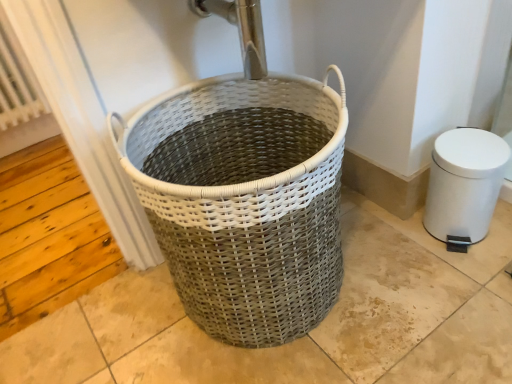
In order to face white plastic bidet at right, should I rotate leftwards or rightwards?

Turn right approximately 26.236 degrees to face it.

Identify the location of white textured radiator at left. Image resolution: width=512 pixels, height=384 pixels. (17, 82).

Image resolution: width=512 pixels, height=384 pixels. What do you see at coordinates (17, 82) in the screenshot? I see `white textured radiator at left` at bounding box center [17, 82].

I want to click on white plastic bidet at right, so click(464, 184).

Is white plastic bidet at right positioned far away from white textured radiator at left?

Yes, white plastic bidet at right and white textured radiator at left are quite far apart.

You are a GUI agent. You are given a task and a screenshot of the screen. Output one action in this format:
    pyautogui.click(x=<x>, y=<y>)
    Task: Click on the bidet located underneath the white textured radiator at left (from a real-world perspective)
    This screenshot has height=384, width=512.
    Given the screenshot: What is the action you would take?
    pyautogui.click(x=464, y=184)

Based on the photo, between white plastic bidet at right and white textured radiator at left, which one has smaller width?

white textured radiator at left.

Measure the distance from white plastic bidet at right to white textured radiator at left.

white plastic bidet at right is 1.58 meters away from white textured radiator at left.

Is the depth of white textured radiator at left greater than that of white woven basket at center?

Yes, it is behind white woven basket at center.

Considering the sizes of white textured radiator at left and white woven basket at center in the image, is white textured radiator at left wider or thinner than white woven basket at center?

white textured radiator at left is thinner than white woven basket at center.

Is white textured radiator at left oriented away from white woven basket at center?

No.

Where is `radiator on the left of white woven basket at center`? Image resolution: width=512 pixels, height=384 pixels. radiator on the left of white woven basket at center is located at coordinates (17, 82).

Which of these two, white plastic bidet at right or white woven basket at center, stands taller?

white woven basket at center.

Looking at this image, which of these two, white plastic bidet at right or white woven basket at center, is thinner?

Thinner between the two is white plastic bidet at right.

From a real-world perspective, is white plastic bidet at right below white woven basket at center?

Yes, from a real-world perspective, white plastic bidet at right is beneath white woven basket at center.

Which point is more distant from viewer, (443, 157) or (282, 108)?

Positioned behind is point (282, 108).

Are white textured radiator at left and white plastic bidet at right beside each other?

They are not placed beside each other.

Is point (7, 37) positioned before point (434, 208)?

No.

Between white textured radiator at left and white plastic bidet at right, which one has smaller size?

Smaller between the two is white plastic bidet at right.

Who is shorter, white textured radiator at left or white plastic bidet at right?

white plastic bidet at right is shorter.

Considering the relative sizes of white woven basket at center and white plastic bidet at right in the image provided, is white woven basket at center wider than white plastic bidet at right?

Correct, the width of white woven basket at center exceeds that of white plastic bidet at right.

From a real-world perspective, between white woven basket at center and white plastic bidet at right, who is vertically lower?

white plastic bidet at right, from a real-world perspective.

Does white woven basket at center appear on the left side of white plastic bidet at right?

Yes, white woven basket at center is to the left of white plastic bidet at right.

In the scene shown: From the image's perspective, is white woven basket at center below white textured radiator at left?

Correct, white woven basket at center appears lower than white textured radiator at left in the image.

Is white woven basket at center facing towards white textured radiator at left?

No, white woven basket at center is not facing towards white textured radiator at left.

Which object is thinner, white woven basket at center or white textured radiator at left?

With smaller width is white textured radiator at left.

This screenshot has height=384, width=512. In order to click on radiator above the white plastic bidet at right (from the image's perspective) in this screenshot , I will do `click(17, 82)`.

You are a GUI agent. You are given a task and a screenshot of the screen. Output one action in this format:
    pyautogui.click(x=<x>, y=<y>)
    Task: Click on the waste container in front of the white textured radiator at left
    This screenshot has width=512, height=384.
    Given the screenshot: What is the action you would take?
    pyautogui.click(x=245, y=201)

When comparing their distances from white textured radiator at left, does white woven basket at center or white plastic bidet at right seem closer?

white woven basket at center.

From the image, which object appears to be nearer to white woven basket at center, white plastic bidet at right or white textured radiator at left?

white plastic bidet at right.

Looking at the image, which one is located closer to white plastic bidet at right, white woven basket at center or white textured radiator at left?

white woven basket at center lies closer to white plastic bidet at right than the other object.

Which object lies nearer to the anchor point white woven basket at center, white textured radiator at left or white plastic bidet at right?

white plastic bidet at right lies closer to white woven basket at center than the other object.

Considering their positions, is white textured radiator at left positioned further to white plastic bidet at right than white woven basket at center?

Based on the image, white textured radiator at left appears to be further to white plastic bidet at right.

Which object lies further to the anchor point white textured radiator at left, white plastic bidet at right or white woven basket at center?

white plastic bidet at right lies further to white textured radiator at left than the other object.

At what (x,y) coordinates should I click in order to perform the action: click on waste container between white textured radiator at left and white plastic bidet at right. Please return your answer as a coordinate pair (x, y). The image size is (512, 384). Looking at the image, I should click on (245, 201).